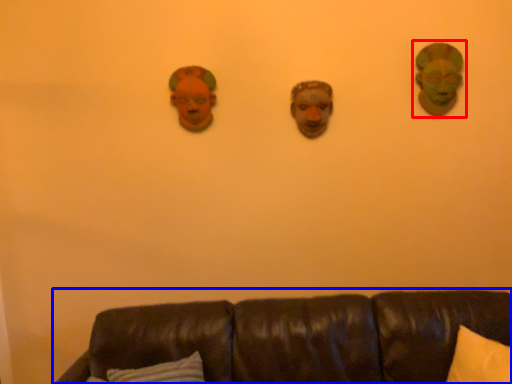
Question: Among these objects, which one is farthest to the camera, person (highlighted by a red box) or studio couch (highlighted by a blue box)?

Choices:
 (A) person
 (B) studio couch

Answer: (A)